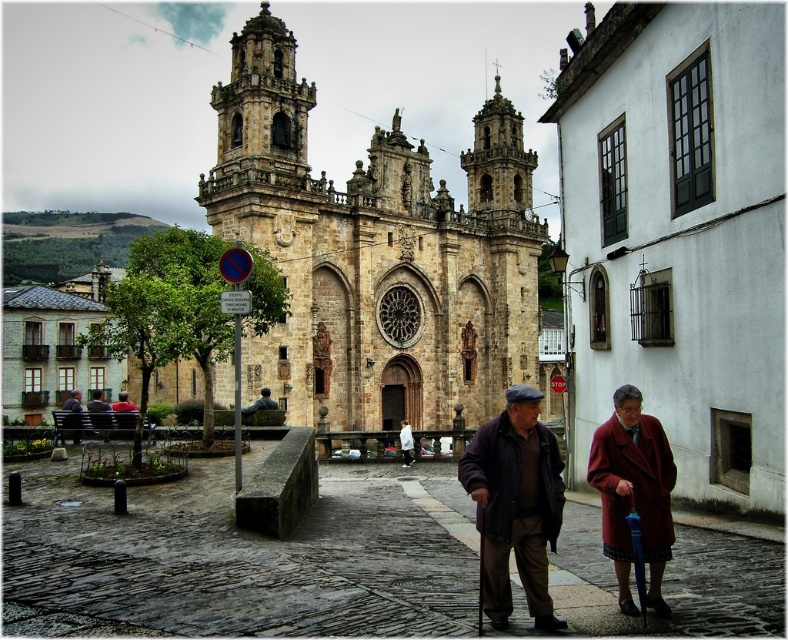
You are visiting the historic church and see the red wool coat at lower right and the matte black bench at lower left. Which object is located more to the right side of the plaza?

The red wool coat at lower right is positioned on the right side of the matte black bench at lower left, so it is more to the right side of the plaza.

You are standing in front of the brown stone church at center and want to take a photo that captures its entire facade. Considering the distance from where you are standing to the church is 72.68 meters, will you be able to fit the entire church in your standard smartphone camera frame without zooming?

The distance of brown stone church at center from camera is 72.68 meters. A standard smartphone camera has a limited field of view, and at this distance, it may not be able to capture the entire facade of the church without zooming. You might need to move closer or use a wide angle lens.

You are a tourist visiting the historic church and need to sit down. You see a red wool coat at lower right and a matte black bench at lower left. Which object is wider?

The red wool coat at lower right is wider than the matte black bench at lower left.